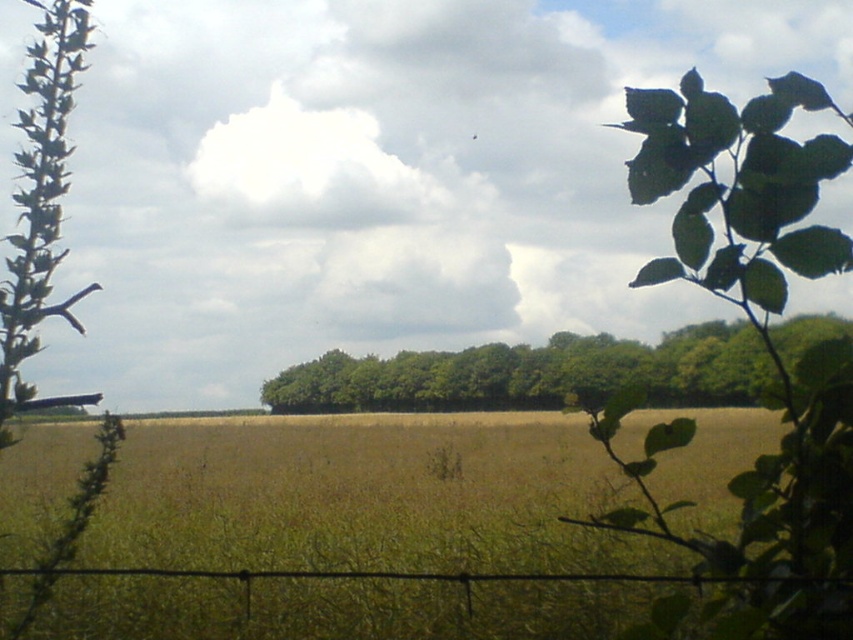
In the scene shown: You are a farmer checking your field. You notice the black wire fence at lower center and the green fuzzy plant at lower left. Which one takes up more area in the image?

The green fuzzy plant at lower left occupies more space than the black wire fence at lower center.

You are a farmer checking the boundaries of your field. You notice the black wire fence at lower center and the green fuzzy plant at lower left. Which object is narrower in width?

The black wire fence at lower center is thinner than the green fuzzy plant at lower left, so the black wire fence at lower center is narrower in width.